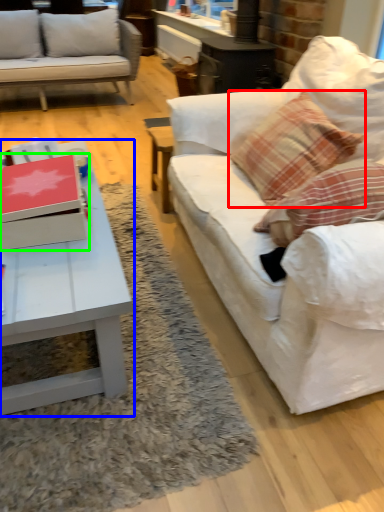
Question: Which object is the closest to the pillow (highlighted by a red box)? Choose among these: coffee table (highlighted by a blue box) or box (highlighted by a green box).

Choices:
 (A) coffee table
 (B) box

Answer: (A)